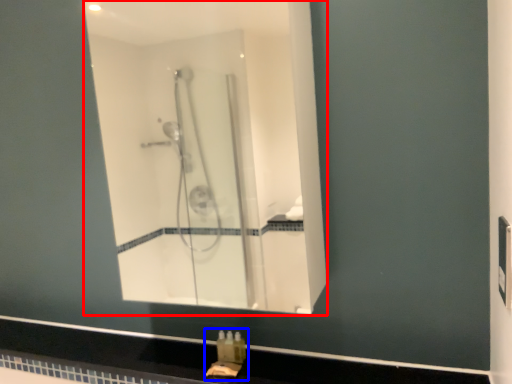
Question: Which object appears farthest to the camera in this image, mirror (highlighted by a red box) or sink (highlighted by a blue box)?

Choices:
 (A) mirror
 (B) sink

Answer: (B)